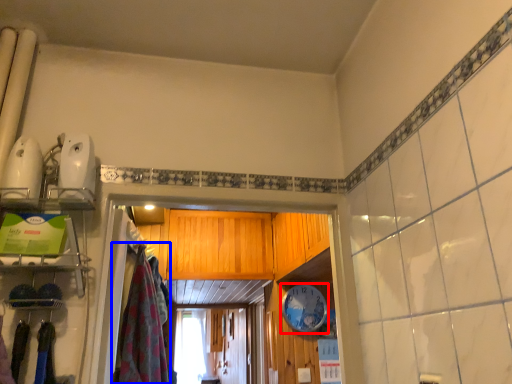
Question: Which point is further to the camera, clock (highlighted by a red box) or clothing (highlighted by a blue box)?

Choices:
 (A) clock
 (B) clothing

Answer: (A)